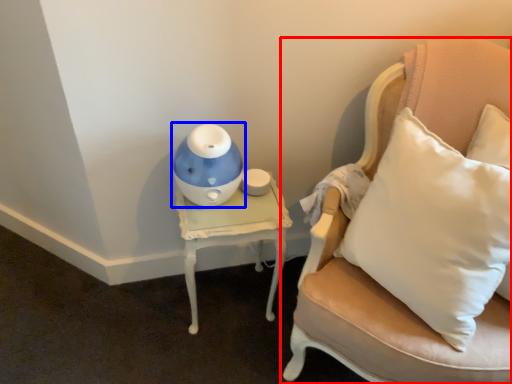
Question: Which of the following is the closest to the observer, chair (highlighted by a red box) or toy (highlighted by a blue box)?

Choices:
 (A) chair
 (B) toy

Answer: (A)